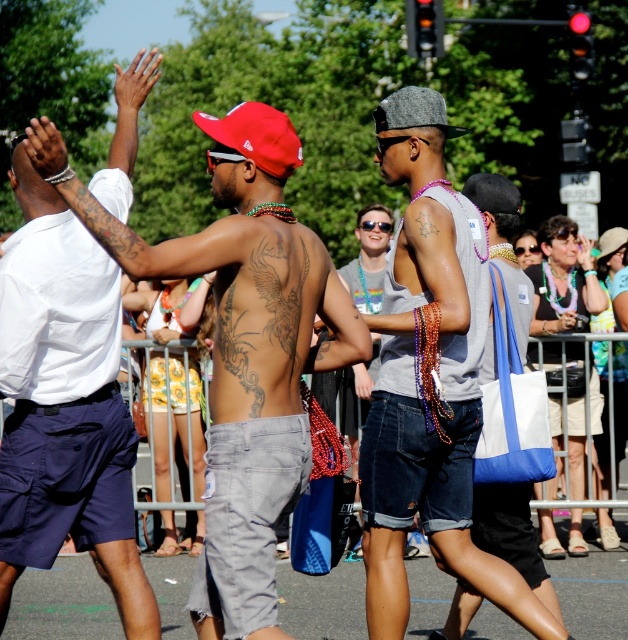
Is denim shorts at center to the left of brown tattooed back at center from the viewer's perspective?

In fact, denim shorts at center is to the right of brown tattooed back at center.

Who is more distant from viewer, (440,525) or (288,234)?

Point (440,525)

Which is behind, point (394, 284) or point (288, 227)?

Positioned behind is point (394, 284).

Image resolution: width=628 pixels, height=640 pixels. I want to click on denim shorts at center, so click(x=430, y=396).

Can you confirm if denim shorts at center is thinner than shiny metallic tank top at center?

Indeed, denim shorts at center has a lesser width compared to shiny metallic tank top at center.

Can you confirm if denim shorts at center is wider than shiny metallic tank top at center?

In fact, denim shorts at center might be narrower than shiny metallic tank top at center.

Is point (376, 384) less distant than point (215, 381)?

No, it is behind (215, 381).

Locate an element on the screen. denim shorts at center is located at coordinates (430, 396).

Does shiny metallic tank top at center have a smaller size compared to gray felt baseball cap at center?

Yes, shiny metallic tank top at center is smaller than gray felt baseball cap at center.

Can you confirm if shiny metallic tank top at center is positioned above gray felt baseball cap at center?

No, shiny metallic tank top at center is not above gray felt baseball cap at center.

Who is more forward, (325, 369) or (403, 96)?

Point (325, 369) is more forward.

Locate an element on the screen. shiny metallic tank top at center is located at coordinates (237, 262).